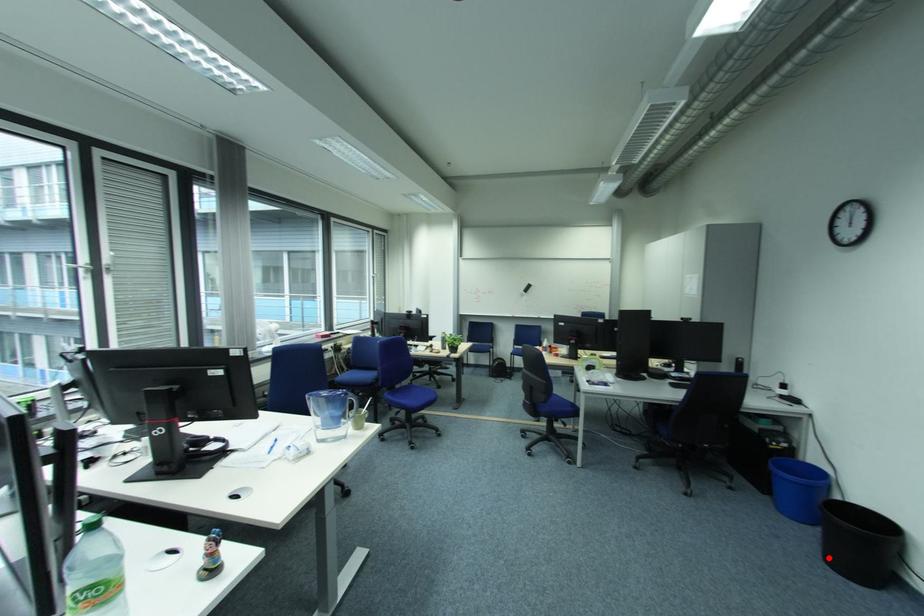
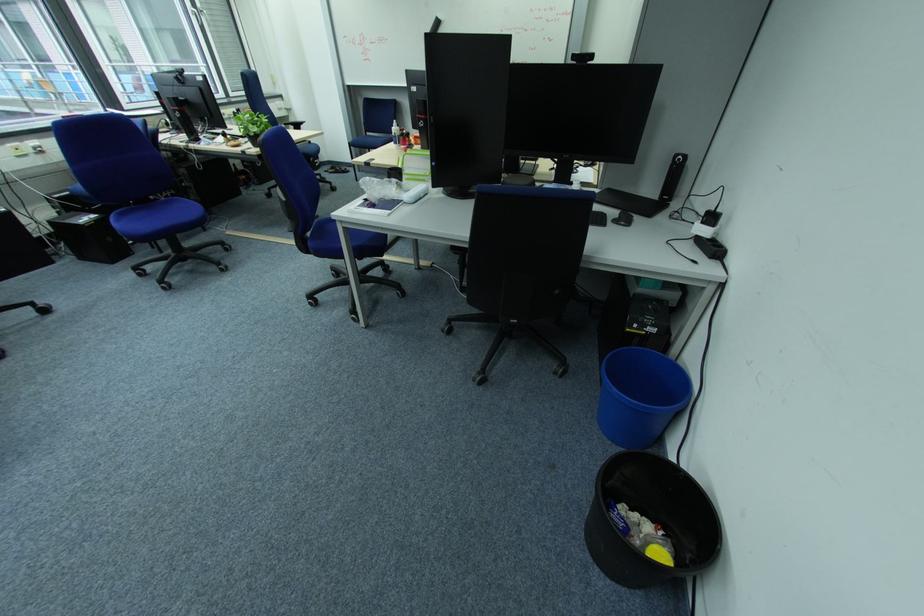
Locate, in the second image, the point that corresponds to the highlighted location in the first image.

(596, 514)